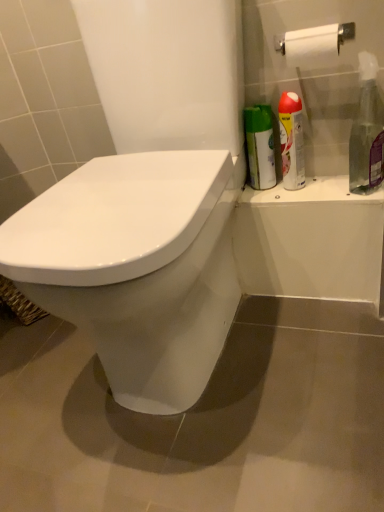
Where is `free space that is in between silver metallic spray can at upper right, which is the 1th cleaning product from left to right, and clear plastic spray bottle at right, marked as the 2th cleaning product in a left-to-right arrangement`? The image size is (384, 512). free space that is in between silver metallic spray can at upper right, which is the 1th cleaning product from left to right, and clear plastic spray bottle at right, marked as the 2th cleaning product in a left-to-right arrangement is located at coordinates (338, 188).